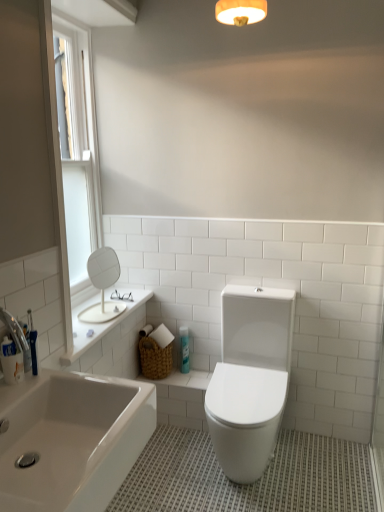
Where is `free location to the left of blue glossy spray can at center`? Image resolution: width=384 pixels, height=512 pixels. free location to the left of blue glossy spray can at center is located at coordinates (172, 376).